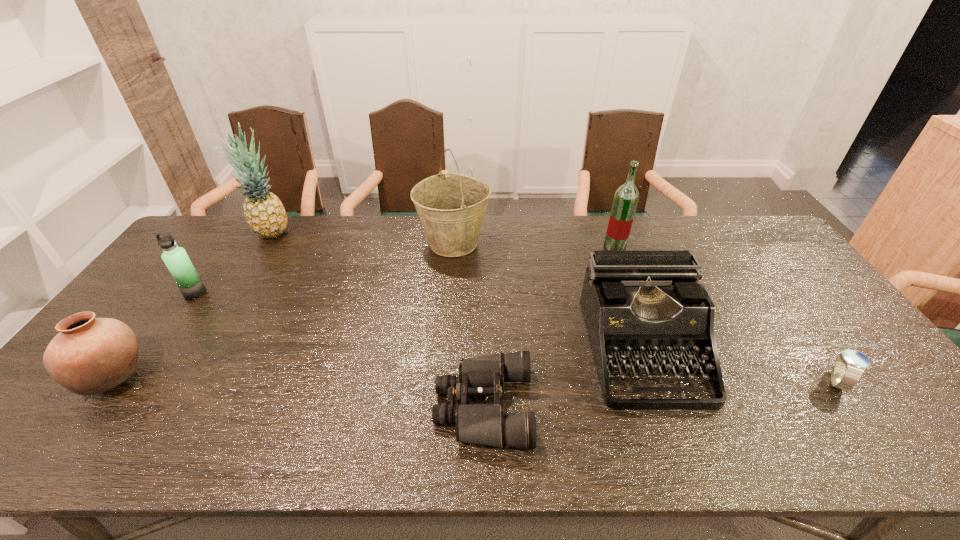
The height and width of the screenshot is (540, 960). I want to click on vacant region between the typewriter and the pottery, so click(378, 363).

The image size is (960, 540). What are the coordinates of `vacant point located between the wine bucket and the binoculars` in the screenshot? It's located at (468, 325).

Locate an element on the screen. This screenshot has height=540, width=960. vacant space in between the pottery and the typewriter is located at coordinates (378, 363).

Locate an element on the screen. This screenshot has height=540, width=960. vacant space that's between the pottery and the wine bucket is located at coordinates (283, 310).

You are a GUI agent. You are given a task and a screenshot of the screen. Output one action in this format:
    pyautogui.click(x=<x>, y=<y>)
    Task: Click on the unoccupied area between the typewriter and the watch
    This screenshot has width=960, height=540.
    Given the screenshot: What is the action you would take?
    pyautogui.click(x=739, y=365)

Where is `free space between the binoculars and the wine bucket`? Image resolution: width=960 pixels, height=540 pixels. free space between the binoculars and the wine bucket is located at coordinates (468, 325).

The image size is (960, 540). Identify the location of empty space between the thermos bottle and the binoculars. (340, 350).

At what (x,y) coordinates should I click in order to perform the action: click on empty space that is in between the thermos bottle and the binoculars. Please return your answer as a coordinate pair (x, y). Looking at the image, I should click on (340, 350).

Select which object is the seventh closest to the pottery. Please provide its 2D coordinates. Your answer should be formatted as a tuple, i.e. [(x, y)], where the tuple contains the x and y coordinates of a point satisfying the conditions above.

[(848, 367)]

Identify which object is the sixth closest to the sixth object from right to left. Please provide its 2D coordinates. Your answer should be formatted as a tuple, i.e. [(x, y)], where the tuple contains the x and y coordinates of a point satisfying the conditions above.

[(626, 197)]